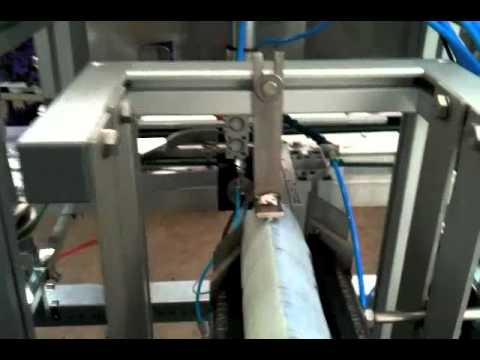
Find the location of a particular element. The height and width of the screenshot is (360, 480). table is located at coordinates (178, 252).